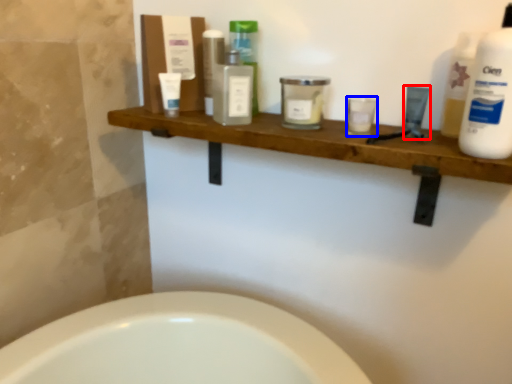
Question: Which object is closer to the camera taking this photo, toiletry (highlighted by a red box) or toiletry (highlighted by a blue box)?

Choices:
 (A) toiletry
 (B) toiletry

Answer: (B)